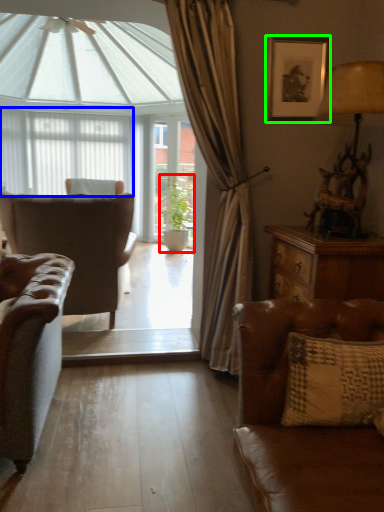
Question: Which is farther away from houseplant (highlighted by a red box)? curtain (highlighted by a blue box) or picture frame (highlighted by a green box)?

Choices:
 (A) curtain
 (B) picture frame

Answer: (B)